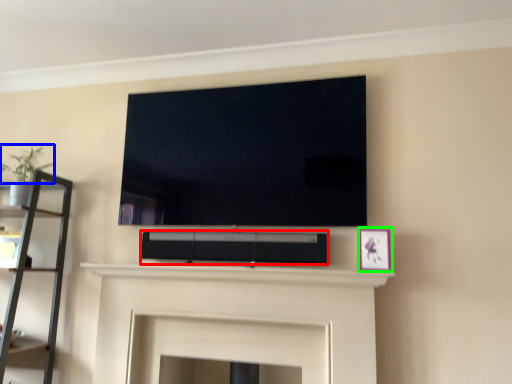
Question: Estimate the real-world distances between objects in this image. Which object is farther from speaker (highlighted by a red box), plant (highlighted by a blue box) or picture frame (highlighted by a green box)?

Choices:
 (A) plant
 (B) picture frame

Answer: (A)